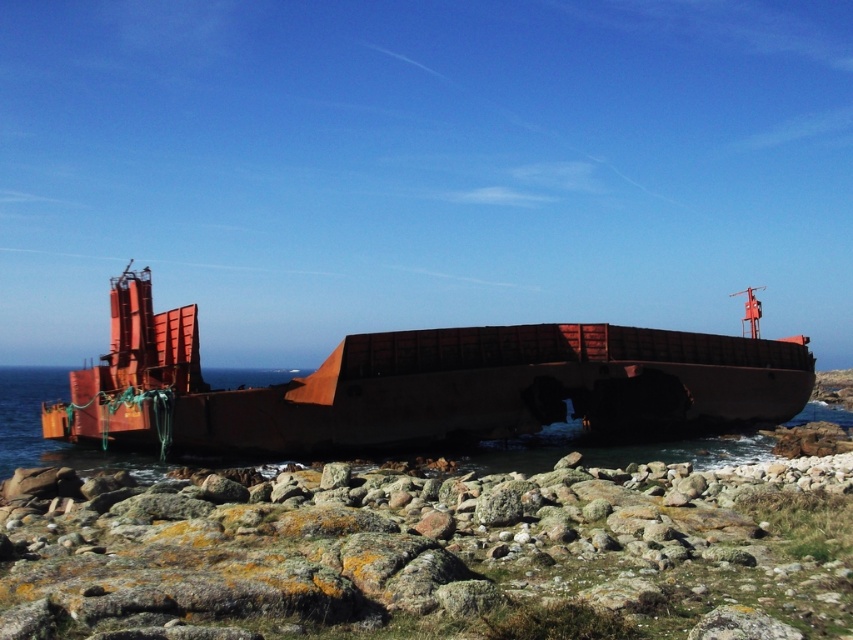
Question: Which point is closer to the camera?

Choices:
 (A) (305, 454)
 (B) (67, 444)

Answer: (A)

Question: Is rusty metal boat at center closer to camera compared to rusty metal water at center?

Choices:
 (A) yes
 (B) no

Answer: (A)

Question: Does rusty metal boat at center have a lesser width compared to rusty metal water at center?

Choices:
 (A) no
 (B) yes

Answer: (B)

Question: Does rusty metal boat at center have a lesser width compared to rusty metal water at center?

Choices:
 (A) yes
 (B) no

Answer: (A)

Question: Among these points, which one is farthest from the camera?

Choices:
 (A) (392, 348)
 (B) (572, 435)

Answer: (B)